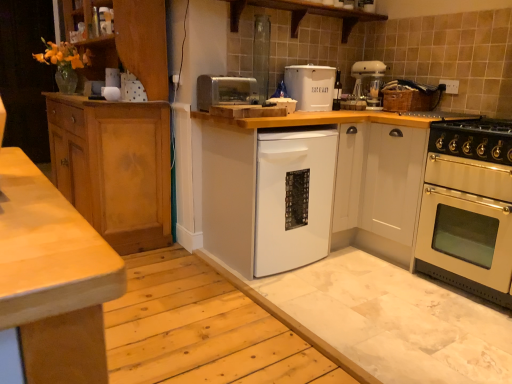
Question: From a real-world perspective, does stainless steel oven at right sit lower than light brown wood cabinet at left, marked as the first cabinetry in a left-to-right arrangement?

Choices:
 (A) yes
 (B) no

Answer: (A)

Question: Is the depth of stainless steel oven at right greater than that of light brown wood cabinet at left, the 3th cabinetry when ordered from right to left?

Choices:
 (A) no
 (B) yes

Answer: (A)

Question: Considering the relative sizes of stainless steel oven at right and light brown wood cabinet at left, marked as the first cabinetry in a left-to-right arrangement, in the image provided, is stainless steel oven at right smaller than light brown wood cabinet at left, marked as the first cabinetry in a left-to-right arrangement,?

Choices:
 (A) yes
 (B) no

Answer: (A)

Question: Considering the relative sizes of stainless steel oven at right and light brown wood cabinet at left, marked as the first cabinetry in a left-to-right arrangement, in the image provided, is stainless steel oven at right taller than light brown wood cabinet at left, marked as the first cabinetry in a left-to-right arrangement,?

Choices:
 (A) yes
 (B) no

Answer: (B)

Question: Is stainless steel oven at right oriented away from light brown wood cabinet at left, marked as the first cabinetry in a left-to-right arrangement?

Choices:
 (A) yes
 (B) no

Answer: (B)

Question: Visually, is white glossy cabinet at right, acting as the 1th cabinetry starting from the right, positioned to the left or to the right of white plastic mixer at upper right?

Choices:
 (A) right
 (B) left

Answer: (A)

Question: Based on their sizes in the image, would you say white glossy cabinet at right, acting as the 1th cabinetry starting from the right, is bigger or smaller than white plastic mixer at upper right?

Choices:
 (A) small
 (B) big

Answer: (B)

Question: Is white glossy cabinet at right, the third cabinetry viewed from the left, taller or shorter than white plastic mixer at upper right?

Choices:
 (A) short
 (B) tall

Answer: (B)

Question: From the image's perspective, is white glossy cabinet at right, the third cabinetry viewed from the left, above or below white plastic mixer at upper right?

Choices:
 (A) above
 (B) below

Answer: (B)

Question: Considering the positions of gold metallic gas stove at right and light brown wood cabinet at left, the 3th cabinetry when ordered from right to left, in the image, is gold metallic gas stove at right taller or shorter than light brown wood cabinet at left, the 3th cabinetry when ordered from right to left,?

Choices:
 (A) short
 (B) tall

Answer: (A)

Question: From the image's perspective, is gold metallic gas stove at right positioned above or below light brown wood cabinet at left, marked as the first cabinetry in a left-to-right arrangement?

Choices:
 (A) below
 (B) above

Answer: (A)

Question: Considering their positions, is gold metallic gas stove at right located in front of or behind light brown wood cabinet at left, the 3th cabinetry when ordered from right to left?

Choices:
 (A) front
 (B) behind

Answer: (A)

Question: Is gold metallic gas stove at right inside or outside of light brown wood cabinet at left, marked as the first cabinetry in a left-to-right arrangement?

Choices:
 (A) outside
 (B) inside

Answer: (A)

Question: Considering the positions of white plastic mixer at upper right and white glossy cabinet at right, acting as the 1th cabinetry starting from the right, in the image, is white plastic mixer at upper right taller or shorter than white glossy cabinet at right, acting as the 1th cabinetry starting from the right,?

Choices:
 (A) tall
 (B) short

Answer: (B)

Question: Choose the correct answer: Is white plastic mixer at upper right inside white glossy cabinet at right, the third cabinetry viewed from the left, or outside it?

Choices:
 (A) inside
 (B) outside

Answer: (B)